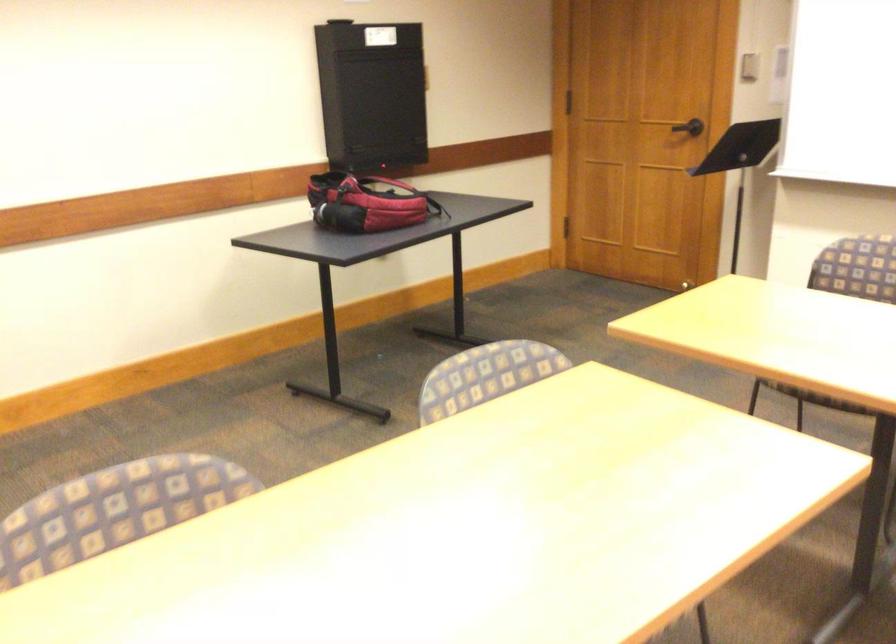
Where would you push the black door handle? Please return your answer as a coordinate pair (x, y).

(688, 127)